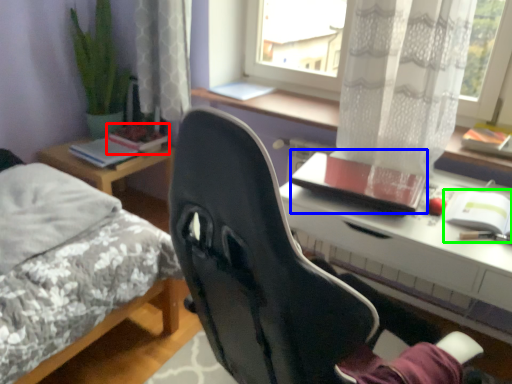
Question: Considering the real-world distances, which object is farthest from book (highlighted by a red box)? notebook (highlighted by a blue box) or notebook (highlighted by a green box)?

Choices:
 (A) notebook
 (B) notebook

Answer: (B)